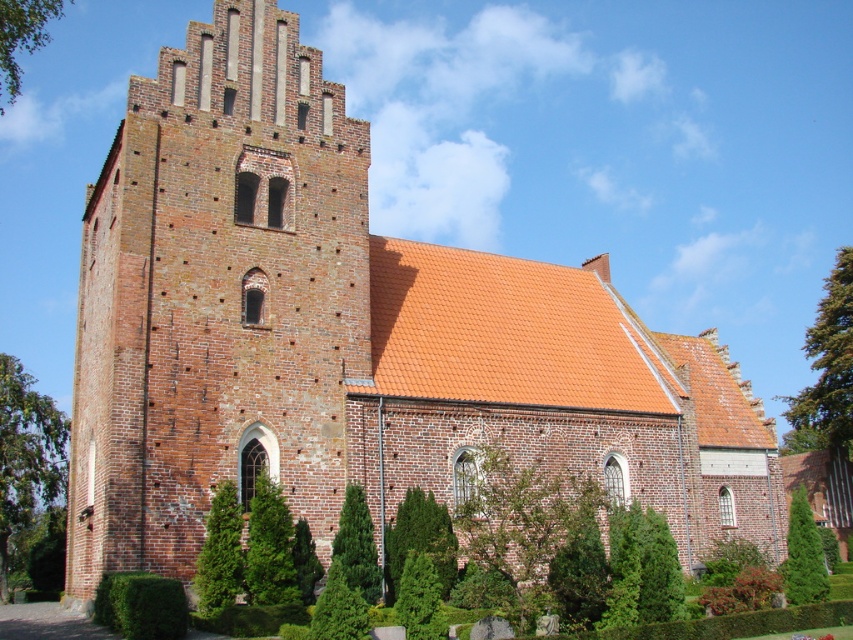
Question: Based on their relative distances, which object is nearer to the green leafy tree at left?

Choices:
 (A) green textured hedge at center
 (B) green textured bush at center
 (C) green leafy tree at upper right
 (D) green textured tree at lower left

Answer: (D)

Question: Can you confirm if green leafy tree at left is positioned to the left of green textured hedge at lower left?

Choices:
 (A) yes
 (B) no

Answer: (A)

Question: Which is farther from the green textured hedge at center?

Choices:
 (A) green textured hedge at lower left
 (B) green leafy tree at left

Answer: (B)

Question: Can you confirm if green leafy tree at upper right is positioned below green leafy tree at upper left?

Choices:
 (A) yes
 (B) no

Answer: (A)

Question: Which object is farther from the camera taking this photo?

Choices:
 (A) green leafy tree at upper right
 (B) green leafy tree at upper left
 (C) green textured hedge at center

Answer: (A)

Question: Is green leafy tree at upper right further to camera compared to green textured hedge at center?

Choices:
 (A) no
 (B) yes

Answer: (B)